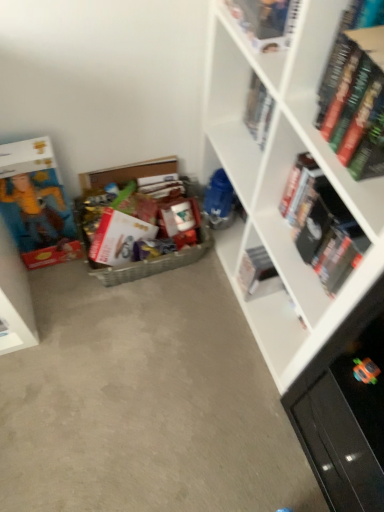
Based on the photo, measure the distance between point (x=197, y=221) and camera.

The distance of point (x=197, y=221) from camera is 4.81 feet.

Where is `matte cardboard box at left`? matte cardboard box at left is located at coordinates (36, 204).

In order to face white matte book at center, the 4th book viewed from the left, should I rotate leftwards or rightwards?

A 9.187 degree turn to the right will do.

This screenshot has height=512, width=384. Describe the element at coordinates (282, 183) in the screenshot. I see `white matte bookcase at right` at that location.

I want to click on white matte bookcase at right, so click(x=282, y=183).

What do you see at coordinates (258, 110) in the screenshot? I see `hardcover book at upper center, which appears as the third book when viewed from the left` at bounding box center [258, 110].

The width and height of the screenshot is (384, 512). I want to click on hardcover book at upper right, which is the second book in right-to-left order, so click(x=323, y=225).

Looking at their sizes, would you say matte cardboard box at center is wider or thinner than matte cardboard box at left?

matte cardboard box at center is wider than matte cardboard box at left.

From a real-world perspective, which is physically below, matte cardboard box at center or matte cardboard box at left?

matte cardboard box at center.

Is the position of matte cardboard box at center more distant than that of matte cardboard box at left?

No, it is not.

This screenshot has height=512, width=384. Find the location of `concrete below the matte cardboard box at left (from a real-world perspective)`. concrete below the matte cardboard box at left (from a real-world perspective) is located at coordinates (145, 402).

Is hardcover book at upper right, which is the second book in right-to-left order, facing towards multicolored cardboard box at center, acting as the 1th book starting from the left?

No, hardcover book at upper right, which is the second book in right-to-left order, is not facing towards multicolored cardboard box at center, acting as the 1th book starting from the left.

Does hardcover book at upper right, which is the 5th book from left to right, come in front of multicolored cardboard box at center, which ranks as the 6th book in right-to-left order?

Yes, hardcover book at upper right, which is the 5th book from left to right, is closer to the camera.

Which object is thinner, hardcover book at upper right, which is the 5th book from left to right, or multicolored cardboard box at center, which ranks as the 6th book in right-to-left order?

hardcover book at upper right, which is the 5th book from left to right.

Is white matte book at center, which is the third book in right-to-left order, facing away from matte cardboard box at left?

white matte book at center, which is the third book in right-to-left order, is not turned away from matte cardboard box at left.

Based on the photo, based on their sizes in the image, would you say white matte book at center, the 4th book viewed from the left, is bigger or smaller than matte cardboard box at left?

Clearly, white matte book at center, the 4th book viewed from the left, is smaller in size than matte cardboard box at left.

Is white matte book at center, the 4th book viewed from the left, in front of or behind matte cardboard box at left in the image?

In the image, white matte book at center, the 4th book viewed from the left, appears behind matte cardboard box at left.

Based on the photo, could you measure the distance between hardcover book at upper center, placed as the second book when sorted from left to right, and hardcover book at upper center, which appears as the third book when viewed from the left?

hardcover book at upper center, placed as the second book when sorted from left to right, is 10.04 inches away from hardcover book at upper center, which appears as the third book when viewed from the left.

Does hardcover book at upper center, placed as the second book when sorted from left to right, turn towards hardcover book at upper center, the fourth book when ordered from right to left?

No.

Who is shorter, hardcover book at upper center, placed as the second book when sorted from left to right, or hardcover book at upper center, the fourth book when ordered from right to left?

hardcover book at upper center, placed as the second book when sorted from left to right, is shorter.

Consider the image. From a real-world perspective, is hardcover book at upper center, placed as the second book when sorted from left to right, located higher than hardcover book at upper center, the fourth book when ordered from right to left?

Correct, in the physical world, hardcover book at upper center, placed as the second book when sorted from left to right, is higher than hardcover book at upper center, the fourth book when ordered from right to left.

Can you confirm if multicolored cardboard box at center, which ranks as the 6th book in right-to-left order, is shorter than white matte book at center, which is the third book in right-to-left order?

No.

Is multicolored cardboard box at center, which ranks as the 6th book in right-to-left order, positioned with its back to white matte book at center, which is the third book in right-to-left order?

No, multicolored cardboard box at center, which ranks as the 6th book in right-to-left order, is not facing the opposite direction of white matte book at center, which is the third book in right-to-left order.

Is multicolored cardboard box at center, acting as the 1th book starting from the left, wider than white matte book at center, the 4th book viewed from the left?

Indeed, multicolored cardboard box at center, acting as the 1th book starting from the left, has a greater width compared to white matte book at center, the 4th book viewed from the left.

From a real-world perspective, is multicolored cardboard box at center, acting as the 1th book starting from the left, positioned above or below white matte bookcase at right?

In terms of real-world spatial position, multicolored cardboard box at center, acting as the 1th book starting from the left, is below white matte bookcase at right.

Is multicolored cardboard box at center, acting as the 1th book starting from the left, surrounding white matte bookcase at right?

That's incorrect, white matte bookcase at right is not inside multicolored cardboard box at center, acting as the 1th book starting from the left.

Are multicolored cardboard box at center, which ranks as the 6th book in right-to-left order, and white matte bookcase at right making contact?

multicolored cardboard box at center, which ranks as the 6th book in right-to-left order, and white matte bookcase at right are clearly separated.

Is the position of multicolored cardboard box at center, acting as the 1th book starting from the left, more distant than that of matte cardboard box at left?

Yes, it is.

From a real-world perspective, between multicolored cardboard box at center, which ranks as the 6th book in right-to-left order, and matte cardboard box at left, who is vertically higher?

matte cardboard box at left.

Does multicolored cardboard box at center, which ranks as the 6th book in right-to-left order, have a greater height compared to matte cardboard box at left?

In fact, multicolored cardboard box at center, which ranks as the 6th book in right-to-left order, may be shorter than matte cardboard box at left.

From the image's perspective, who appears lower, multicolored cardboard box at center, acting as the 1th book starting from the left, or matte cardboard box at left?

multicolored cardboard box at center, acting as the 1th book starting from the left, appears lower in the image.

I want to click on concrete that is on the right side of matte cardboard box at left, so click(145, 402).

From a real-world perspective, count 3rd books upward from the multicolored cardboard box at center, acting as the 1th book starting from the left, and point to it. Please provide its 2D coordinates.

[(323, 225)]

From the image, which object appears to be nearer to matte cardboard box at center, hardcover book at upper center, which ranks as the 5th book in right-to-left order, or hardcover book at upper right, which is the second book in right-to-left order?

hardcover book at upper right, which is the second book in right-to-left order.

Looking at the image, which one is located closer to hardcover book at upper center, the fourth book when ordered from right to left, hardcover book at upper center, which ranks as the 5th book in right-to-left order, or matte cardboard box at center?

hardcover book at upper center, which ranks as the 5th book in right-to-left order, lies closer to hardcover book at upper center, the fourth book when ordered from right to left, than the other object.

Considering their positions, is white matte book at center, which is the third book in right-to-left order, positioned further to white matte bookcase at right than matte cardboard box at left?

matte cardboard box at left is further to white matte bookcase at right.

Based on their spatial positions, is hardcover book at upper right, which appears as the sixth book when viewed from the left, or matte cardboard box at center further from white matte book at center, the 4th book viewed from the left?

The object further to white matte book at center, the 4th book viewed from the left, is hardcover book at upper right, which appears as the sixth book when viewed from the left.

Looking at the image, which one is located closer to hardcover book at upper center, which ranks as the 5th book in right-to-left order, white matte book at center, which is the third book in right-to-left order, or hardcover book at upper right, which is the second book in right-to-left order?

Based on the image, hardcover book at upper right, which is the second book in right-to-left order, appears to be nearer to hardcover book at upper center, which ranks as the 5th book in right-to-left order.

Estimate the real-world distances between objects in this image. Which object is closer to hardcover book at upper center, which ranks as the 5th book in right-to-left order, white matte book at center, which is the third book in right-to-left order, or white matte bookcase at right?

The object closer to hardcover book at upper center, which ranks as the 5th book in right-to-left order, is white matte bookcase at right.

Considering their positions, is hardcover book at upper right, which is the 5th book from left to right, positioned further to hardcover book at upper center, which ranks as the 5th book in right-to-left order, than multicolored cardboard box at center, which ranks as the 6th book in right-to-left order?

Based on the image, multicolored cardboard box at center, which ranks as the 6th book in right-to-left order, appears to be further to hardcover book at upper center, which ranks as the 5th book in right-to-left order.

From the picture: Estimate the real-world distances between objects in this image. Which object is closer to matte cardboard box at center, matte cardboard box at left or hardcover book at upper right, which is the 5th book from left to right?

Based on the image, matte cardboard box at left appears to be nearer to matte cardboard box at center.

Where is `concrete situated between matte cardboard box at left and hardcover book at upper right, which is the 5th book from left to right, from left to right`? This screenshot has width=384, height=512. concrete situated between matte cardboard box at left and hardcover book at upper right, which is the 5th book from left to right, from left to right is located at coordinates (145, 402).

Identify the location of bookcase between hardcover book at upper center, which ranks as the 5th book in right-to-left order, and matte cardboard box at center vertically. (282, 183).

Identify the location of concrete between matte cardboard box at left and hardcover book at upper right, which appears as the sixth book when viewed from the left, from left to right. The height and width of the screenshot is (512, 384). (145, 402).

The width and height of the screenshot is (384, 512). I want to click on concrete located between white matte bookcase at right and white matte book at center, the 4th book viewed from the left, in the depth direction, so click(145, 402).